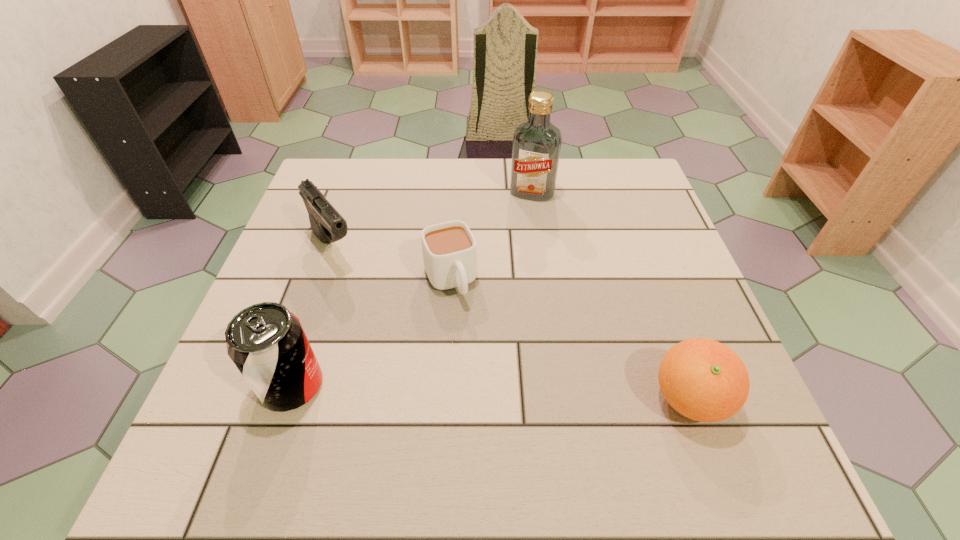
The height and width of the screenshot is (540, 960). I want to click on vacant space on the desktop that is between the soda can and the fourth tallest object and is positioned at the barrel of the pistol, so click(x=446, y=391).

Where is `vacant spot on the desktop that is between the soda can and the fourth tallest object and is positioned on the side with the handle of the cup`? This screenshot has width=960, height=540. vacant spot on the desktop that is between the soda can and the fourth tallest object and is positioned on the side with the handle of the cup is located at coordinates (500, 393).

The width and height of the screenshot is (960, 540). Find the location of `free spot on the desktop that is between the soda can and the rightmost object and is positioned on the front-facing side of the farthest object`. free spot on the desktop that is between the soda can and the rightmost object and is positioned on the front-facing side of the farthest object is located at coordinates (458, 392).